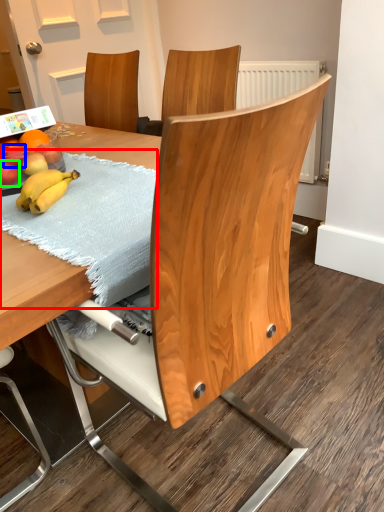
Question: Estimate the real-world distances between objects in this image. Which object is farther from blanket (highlighted by a red box), apple (highlighted by a blue box) or apple (highlighted by a green box)?

Choices:
 (A) apple
 (B) apple

Answer: (A)